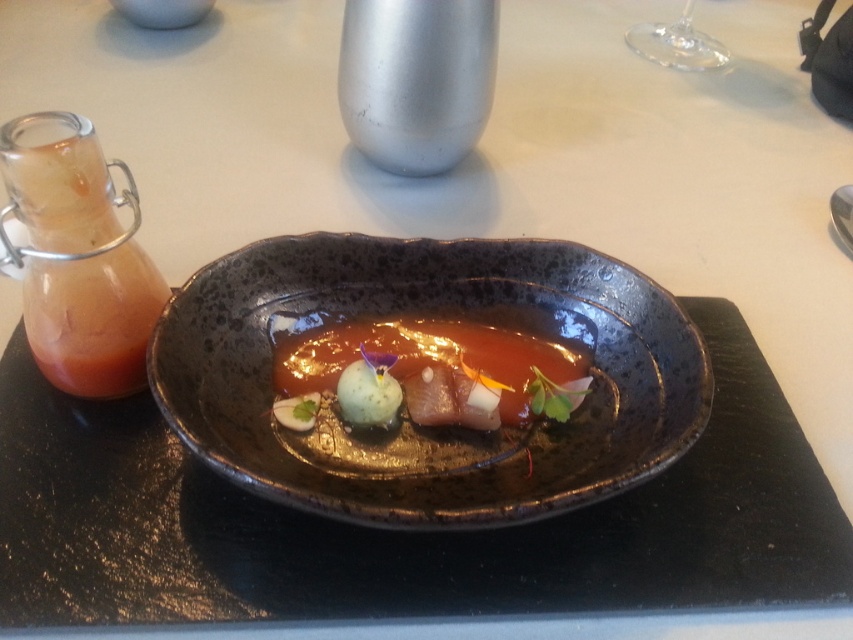
You are a food stylist arranging a photo shoot setup. You need to place the translucent glass bottle at left and the glossy ceramic plate at center in a way that avoids any shadows from the bottle falling onto the plate. Given their current positions, is the bottle casting a shadow on the plate?

The translucent glass bottle at left is positioned over the glossy ceramic plate at center, so it is likely casting a shadow on the plate. Adjust the bottle or lighting to prevent this.

You are a photographer trying to capture the dish from above. You notice two points on the plate, one at point (x=576, y=490) and another at point (x=467, y=388). Which point will appear closer to the top edge of the photo?

Point (x=576, y=490) is closer to the camera than point (x=467, y=388), so it will appear closer to the top edge of the photo.